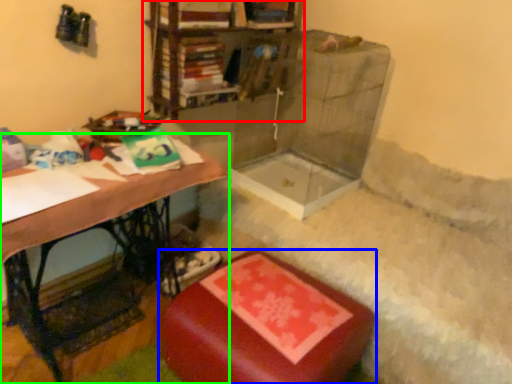
Question: Which object is the closest to the shelf (highlighted by a red box)? Choose among these: furniture (highlighted by a blue box) or table (highlighted by a green box).

Choices:
 (A) furniture
 (B) table

Answer: (B)